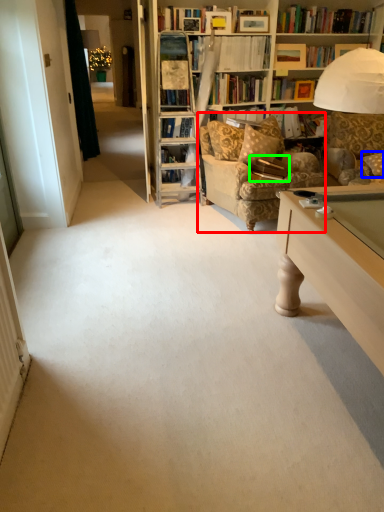
Question: Considering the real-world distances, which object is closest to chair (highlighted by a red box)? pillow (highlighted by a blue box) or book (highlighted by a green box).

Choices:
 (A) pillow
 (B) book

Answer: (B)